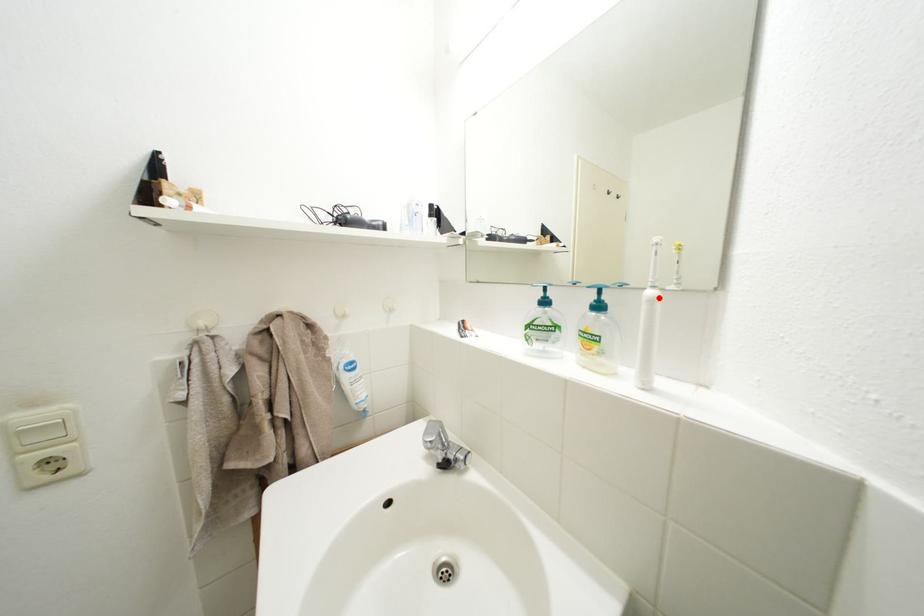
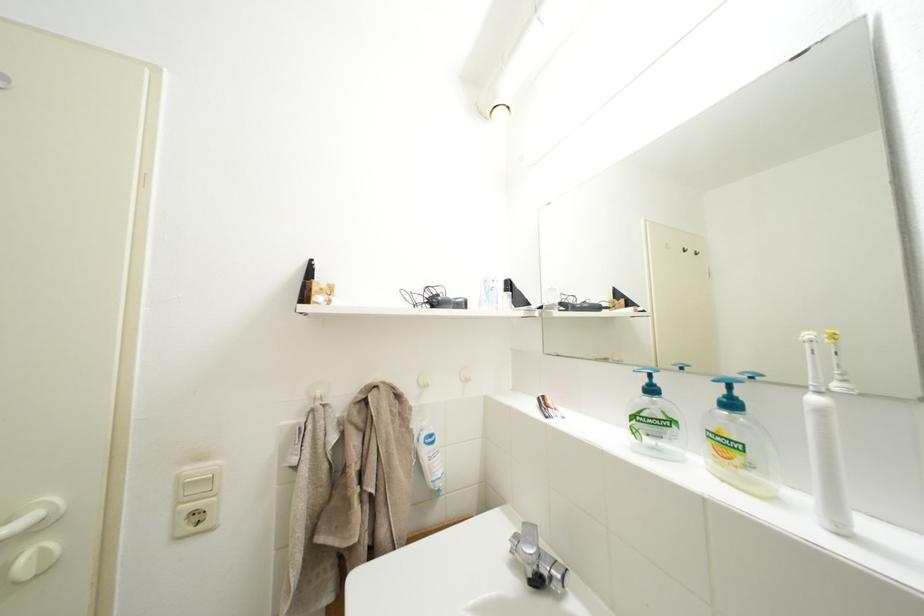
Where in the second image is the point corresponding to the highlighted location from the first image?

(823, 405)